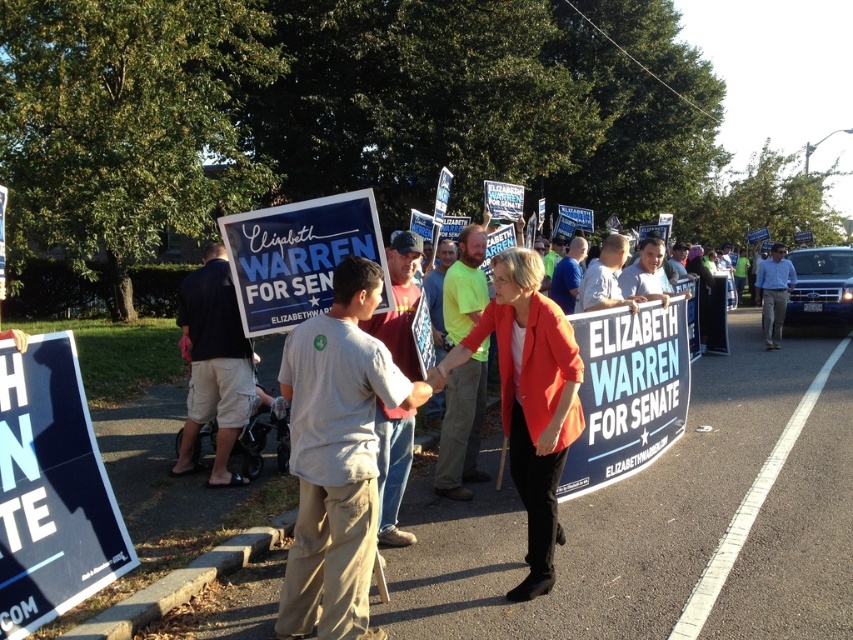
You are a photographer at the rally and want to focus your camera on both the point at coordinates point (227, 369) and point (775, 250). Which point should you adjust your focus on first to ensure both are in sharp focus?

You should focus on point (227, 369) first because it is closer to the camera than point (775, 250). By focusing on the closer point, the farther point will also be in focus due to the depth of field.